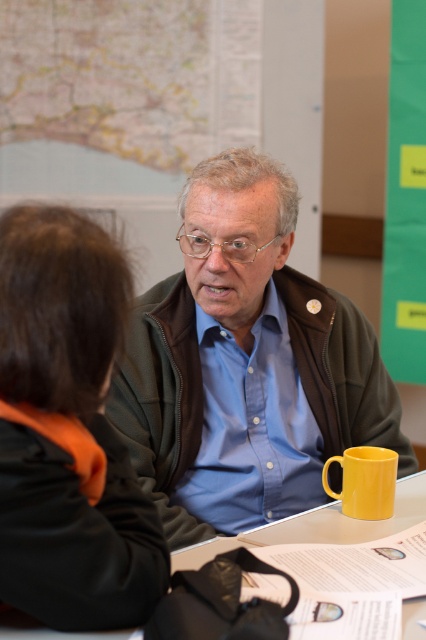
Question: Can you confirm if yellow matte/metallic table at center is thinner than yellow matte mug at lower right?

Choices:
 (A) no
 (B) yes

Answer: (A)

Question: Can you confirm if matte brown jacket at center is positioned to the right of yellow matte mug at lower right?

Choices:
 (A) no
 (B) yes

Answer: (A)

Question: Considering the real-world distances, which object is closest to the black fabric jacket at lower left?

Choices:
 (A) yellow matte mug at lower right
 (B) matte brown jacket at center
 (C) yellow matte/metallic table at center

Answer: (C)

Question: Among these points, which one is farthest from the camera?

Choices:
 (A) (377, 508)
 (B) (423, 476)

Answer: (B)

Question: Is matte brown jacket at center bigger than black fabric jacket at lower left?

Choices:
 (A) yes
 (B) no

Answer: (A)

Question: Based on their relative distances, which object is farther from the yellow matte/metallic table at center?

Choices:
 (A) matte brown jacket at center
 (B) black fabric jacket at lower left

Answer: (A)